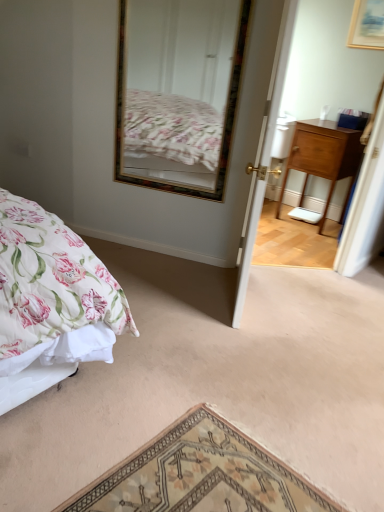
Where is `vacant area situated below wooden-framed mirror at upper center (from a real-world perspective)`? vacant area situated below wooden-framed mirror at upper center (from a real-world perspective) is located at coordinates (161, 244).